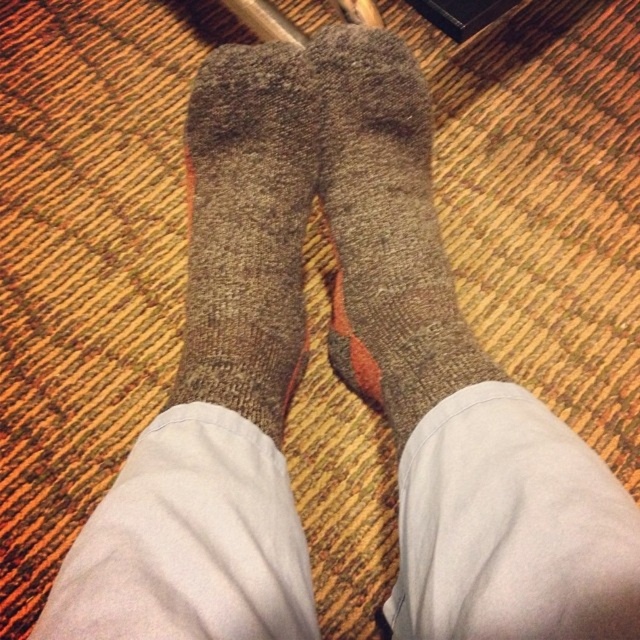
Question: Where is woolen socks at center located in relation to gray woolen sock at center in the image?

Choices:
 (A) above
 (B) below

Answer: (A)

Question: Can you confirm if woolen socks at center is positioned above gray woolen sock at center?

Choices:
 (A) yes
 (B) no

Answer: (A)

Question: Which point is closer to the camera?

Choices:
 (A) gray woolen sock at center
 (B) woolen socks at center

Answer: (A)

Question: Does woolen socks at center appear under gray woolen sock at center?

Choices:
 (A) yes
 (B) no

Answer: (B)